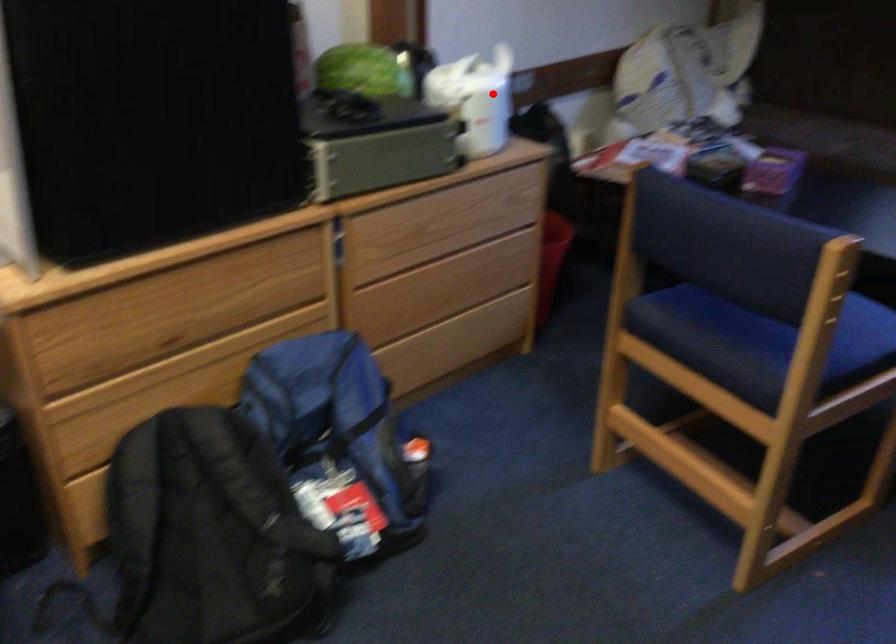
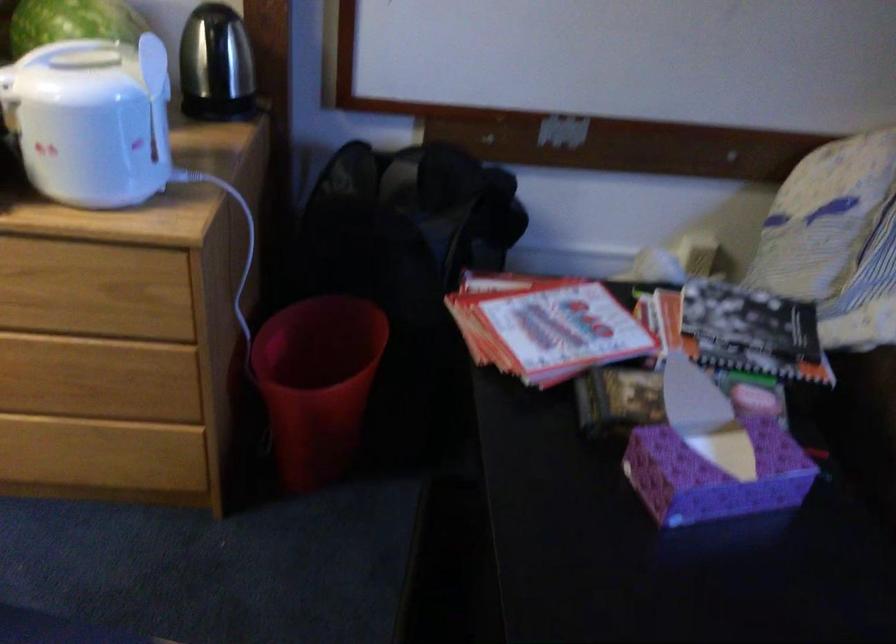
Where in the second image is the point corresponding to the highlighted location from the first image?

(91, 120)